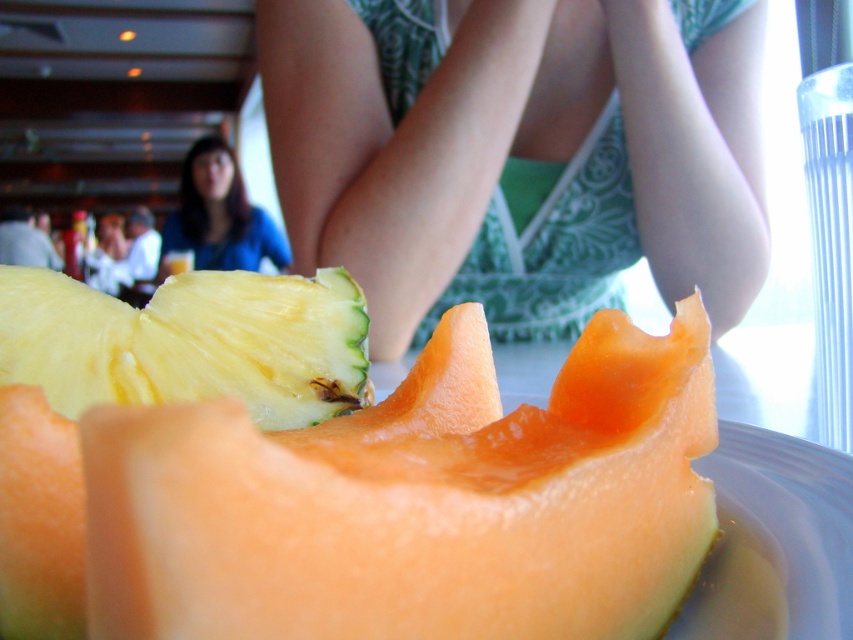
You are a fashion designer observing the image. You need to determine which fabric item is larger between the green printed fabric at center and the blue fabric shirt at upper left. Which one is bigger?

The green printed fabric at center is bigger than the blue fabric shirt at upper left.